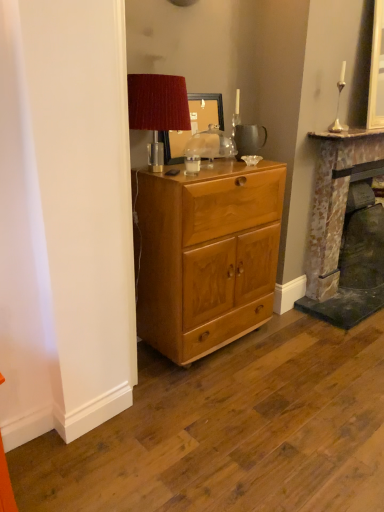
The height and width of the screenshot is (512, 384). I want to click on velvet red lampshade at upper center, so click(x=157, y=102).

The width and height of the screenshot is (384, 512). In order to click on fireplace located underneath the wooden picture frame at center (from a real-world perspective) in this screenshot , I will do `click(346, 231)`.

Are wooden picture frame at center and rustic stone fireplace at right far apart?

That's right, there is a large distance between wooden picture frame at center and rustic stone fireplace at right.

Who is shorter, wooden picture frame at center or rustic stone fireplace at right?

wooden picture frame at center is shorter.

From the image's perspective, between wooden picture frame at center and rustic stone fireplace at right, who is located below?

From the image's view, rustic stone fireplace at right is below.

From the image's perspective, is rustic stone fireplace at right below wooden picture frame at center?

Yes.

Based on the photo, considering the sizes of rustic stone fireplace at right and wooden picture frame at center in the image, is rustic stone fireplace at right wider or thinner than wooden picture frame at center?

Clearly, rustic stone fireplace at right has more width compared to wooden picture frame at center.

Which point is more forward, (367,176) or (194,116)?

The point (194,116) is closer.

Considering the sizes of velvet red lampshade at upper center and light brown wood cabinet at center in the image, is velvet red lampshade at upper center bigger or smaller than light brown wood cabinet at center?

Considering their sizes, velvet red lampshade at upper center takes up less space than light brown wood cabinet at center.

Is velvet red lampshade at upper center completely or partially outside of light brown wood cabinet at center?

Absolutely, velvet red lampshade at upper center is external to light brown wood cabinet at center.

From the image's perspective, which one is positioned lower, velvet red lampshade at upper center or light brown wood cabinet at center?

From the image's view, light brown wood cabinet at center is below.

Which is more to the right, velvet red lampshade at upper center or light brown wood cabinet at center?

Positioned to the right is light brown wood cabinet at center.

Would you consider wooden picture frame at center to be distant from velvet red lampshade at upper center?

No, wooden picture frame at center is not far away from velvet red lampshade at upper center.

Which object is positioned more to the left, wooden picture frame at center or velvet red lampshade at upper center?

velvet red lampshade at upper center.

From a real-world perspective, which is physically above, wooden picture frame at center or velvet red lampshade at upper center?

velvet red lampshade at upper center, from a real-world perspective.

Does point (168, 162) appear closer or farther from the camera than point (169, 123)?

Clearly, point (168, 162) is more distant from the camera than point (169, 123).

In terms of width, does rustic stone fireplace at right look wider or thinner when compared to silver metallic candle holder at upper right?

Considering their sizes, rustic stone fireplace at right looks broader than silver metallic candle holder at upper right.

Can you confirm if rustic stone fireplace at right is smaller than silver metallic candle holder at upper right?

No.

Is rustic stone fireplace at right beside silver metallic candle holder at upper right?

No.

This screenshot has height=512, width=384. I want to click on picture frame on the left side of light brown wood cabinet at center, so click(x=193, y=124).

Which object is thinner, wooden picture frame at center or light brown wood cabinet at center?

Thinner between the two is wooden picture frame at center.

What's the angular difference between wooden picture frame at center and light brown wood cabinet at center's facing directions?

1.22 degrees.

Looking at the image, does wooden picture frame at center seem bigger or smaller compared to light brown wood cabinet at center?

In the image, wooden picture frame at center appears to be smaller than light brown wood cabinet at center.

Is the surface of light brown wood cabinet at center in direct contact with silver metallic candle holder at upper right?

No, light brown wood cabinet at center is not beside silver metallic candle holder at upper right.

Find the location of a particular element. chest of drawers in front of the silver metallic candle holder at upper right is located at coordinates (207, 255).

From the image's perspective, would you say light brown wood cabinet at center is shown under silver metallic candle holder at upper right?

Yes, from the image's perspective, light brown wood cabinet at center is below silver metallic candle holder at upper right.

Based on the photo, in terms of width, does light brown wood cabinet at center look wider or thinner when compared to silver metallic candle holder at upper right?

Clearly, light brown wood cabinet at center has more width compared to silver metallic candle holder at upper right.

Image resolution: width=384 pixels, height=512 pixels. Find the location of `fireplace below the wooden picture frame at center (from a real-world perspective)`. fireplace below the wooden picture frame at center (from a real-world perspective) is located at coordinates (346, 231).

Image resolution: width=384 pixels, height=512 pixels. Find the location of `picture frame above the rustic stone fireplace at right (from the image's perspective)`. picture frame above the rustic stone fireplace at right (from the image's perspective) is located at coordinates (193, 124).

Considering their positions, is light brown wood cabinet at center positioned closer to rustic stone fireplace at right than velvet red lampshade at upper center?

The object closer to rustic stone fireplace at right is light brown wood cabinet at center.

Which object lies further to the anchor point light brown wood cabinet at center, rustic stone fireplace at right or silver metallic candle holder at upper right?

The object further to light brown wood cabinet at center is silver metallic candle holder at upper right.

Consider the image. Considering their positions, is light brown wood cabinet at center positioned further to wooden picture frame at center than rustic stone fireplace at right?

rustic stone fireplace at right.

Considering their positions, is light brown wood cabinet at center positioned further to rustic stone fireplace at right than wooden picture frame at center?

wooden picture frame at center lies further to rustic stone fireplace at right than the other object.

Estimate the real-world distances between objects in this image. Which object is further from rustic stone fireplace at right, wooden picture frame at center or silver metallic candle holder at upper right?

wooden picture frame at center.

Which object lies further to the anchor point light brown wood cabinet at center, velvet red lampshade at upper center or wooden picture frame at center?

velvet red lampshade at upper center is positioned further to the anchor light brown wood cabinet at center.

Considering their positions, is wooden picture frame at center positioned closer to velvet red lampshade at upper center than light brown wood cabinet at center?

wooden picture frame at center is closer to velvet red lampshade at upper center.

Which object lies nearer to the anchor point rustic stone fireplace at right, silver metallic candle holder at upper right or light brown wood cabinet at center?

silver metallic candle holder at upper right is closer to rustic stone fireplace at right.

Locate an element on the screen. Image resolution: width=384 pixels, height=512 pixels. the chest of drawers situated between velvet red lampshade at upper center and silver metallic candle holder at upper right from left to right is located at coordinates (207, 255).

At what (x,y) coordinates should I click in order to perform the action: click on picture frame situated between velvet red lampshade at upper center and rustic stone fireplace at right from left to right. Please return your answer as a coordinate pair (x, y). Looking at the image, I should click on (193, 124).

At what (x,y) coordinates should I click in order to perform the action: click on picture frame that lies between silver metallic candle holder at upper right and light brown wood cabinet at center from top to bottom. Please return your answer as a coordinate pair (x, y). Looking at the image, I should click on (193, 124).

Identify the location of candle holder between wooden picture frame at center and rustic stone fireplace at right in the horizontal direction. (339, 103).